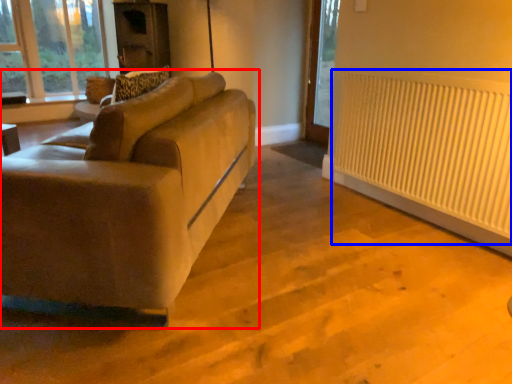
Question: Which object is further to the camera taking this photo, studio couch (highlighted by a red box) or radiator (highlighted by a blue box)?

Choices:
 (A) studio couch
 (B) radiator

Answer: (B)